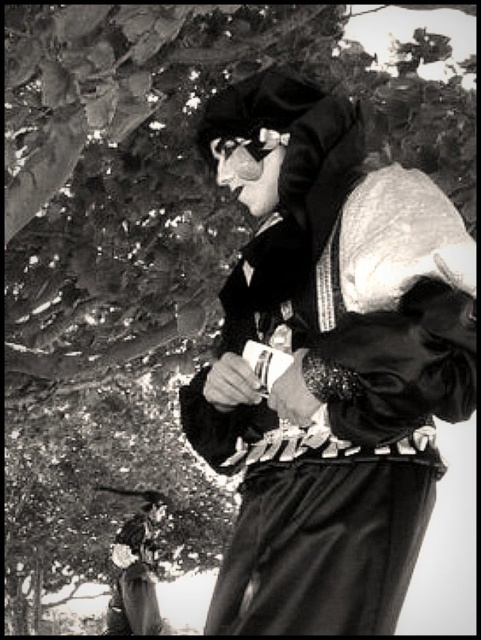
Is velvet black mask at center taller than velvet black hat at lower left?

Yes.

Does point (304, 198) come behind point (113, 621)?

No, (304, 198) is in front of (113, 621).

Locate an element on the screen. The width and height of the screenshot is (481, 640). velvet black mask at center is located at coordinates pyautogui.click(x=330, y=368).

Identify the location of velvet black mask at center. The width and height of the screenshot is (481, 640). (330, 368).

Measure the distance between point (153, 561) and camera.

10.00 meters

Who is more distant from viewer, (115, 547) or (252, 140)?

Positioned behind is point (115, 547).

Between point (115, 624) and point (248, 154), which one is positioned behind?

The point (115, 624) is more distant.

Where is `velvet black hat at lower left`? The width and height of the screenshot is (481, 640). velvet black hat at lower left is located at coordinates (136, 570).

Image resolution: width=481 pixels, height=640 pixels. Describe the element at coordinates (330, 368) in the screenshot. I see `velvet black mask at center` at that location.

Which is more to the right, velvet black mask at center or metallic reflective goggles at center?

Positioned to the right is velvet black mask at center.

The image size is (481, 640). What are the coordinates of `velvet black mask at center` in the screenshot? It's located at (330, 368).